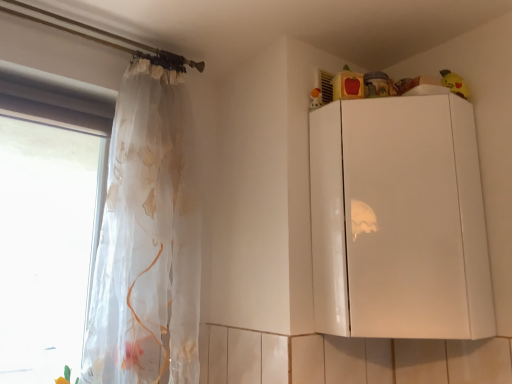
Question: Does transparent fabric at left appear on the right side of translucent floral fabric at left?

Choices:
 (A) yes
 (B) no

Answer: (B)

Question: Considering the relative sizes of transparent fabric at left and translucent floral fabric at left in the image provided, is transparent fabric at left thinner than translucent floral fabric at left?

Choices:
 (A) yes
 (B) no

Answer: (A)

Question: Is transparent fabric at left taller than translucent floral fabric at left?

Choices:
 (A) no
 (B) yes

Answer: (A)

Question: Is transparent fabric at left located outside translucent floral fabric at left?

Choices:
 (A) no
 (B) yes

Answer: (B)

Question: Does transparent fabric at left turn towards translucent floral fabric at left?

Choices:
 (A) yes
 (B) no

Answer: (A)

Question: Is transparent fabric at left shorter than translucent floral fabric at left?

Choices:
 (A) no
 (B) yes

Answer: (B)

Question: Considering the relative sizes of yellow plush toy at upper right, positioned as the 2th toy in left-to-right order, and transparent fabric at left in the image provided, is yellow plush toy at upper right, positioned as the 2th toy in left-to-right order, shorter than transparent fabric at left?

Choices:
 (A) no
 (B) yes

Answer: (B)

Question: Considering the relative sizes of yellow plush toy at upper right, positioned as the 2th toy in left-to-right order, and transparent fabric at left in the image provided, is yellow plush toy at upper right, positioned as the 2th toy in left-to-right order, wider than transparent fabric at left?

Choices:
 (A) yes
 (B) no

Answer: (B)

Question: Is yellow plush toy at upper right, positioned as the 2th toy in left-to-right order, closer to the viewer compared to transparent fabric at left?

Choices:
 (A) no
 (B) yes

Answer: (A)

Question: Does yellow plush toy at upper right, which appears as the 1th toy when viewed from the right, appear on the left side of transparent fabric at left?

Choices:
 (A) yes
 (B) no

Answer: (B)

Question: Is transparent fabric at left completely or partially inside yellow plush toy at upper right, positioned as the 2th toy in left-to-right order?

Choices:
 (A) no
 (B) yes

Answer: (A)

Question: Can you confirm if yellow plush toy at upper right, positioned as the 2th toy in left-to-right order, is smaller than transparent fabric at left?

Choices:
 (A) yes
 (B) no

Answer: (A)

Question: Is transparent fabric at left surrounded by white glossy cabinet at upper right?

Choices:
 (A) no
 (B) yes

Answer: (A)